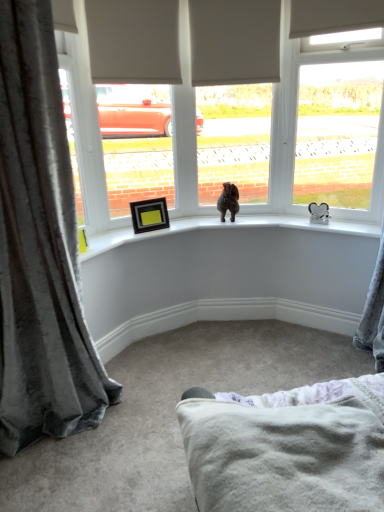
The width and height of the screenshot is (384, 512). What are the coordinates of `free location to the left of brown plush bear at center` in the screenshot? It's located at (204, 221).